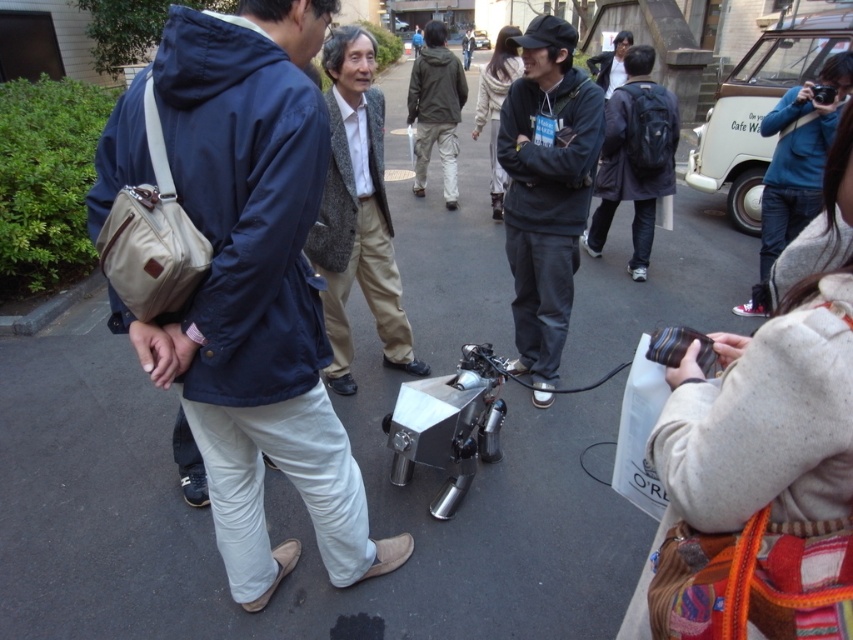
You are a delivery robot that needs to navigate through the crowd to reach the destination. There are two jackets in your path. Which jacket is closer to you, the matte blue jacket at center or the blue denim jacket at upper right?

The matte blue jacket at center is closer to you because it is positioned below the blue denim jacket at upper right, meaning it is in a lower spatial position and thus nearer in the scene.

You are a fashion designer observing a group of people in an urban setting. You notice two clothing items in the scene. Which clothing item is closer to you, the gray tweed blazer at center or the blue denim jacket at upper right?

The gray tweed blazer at center is closer to you because it is positioned in front of the blue denim jacket at upper right.

You are a delivery robot that needs to deliver a package to the person wearing the matte blue jacket at center and the blue denim jacket at upper right. Which person should you approach first based on their proximity to you?

You should approach the matte blue jacket at center first because it is closer to you than the blue denim jacket at upper right.